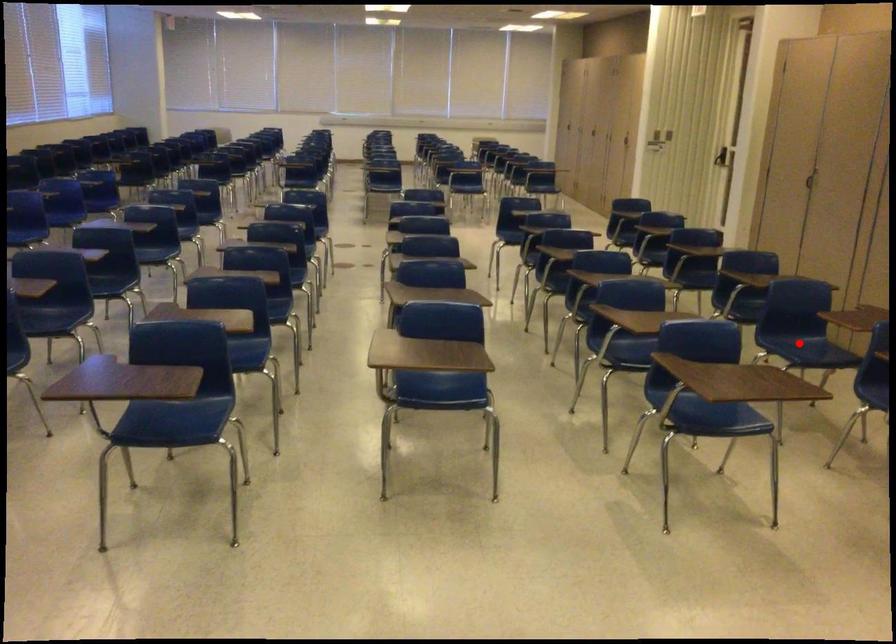
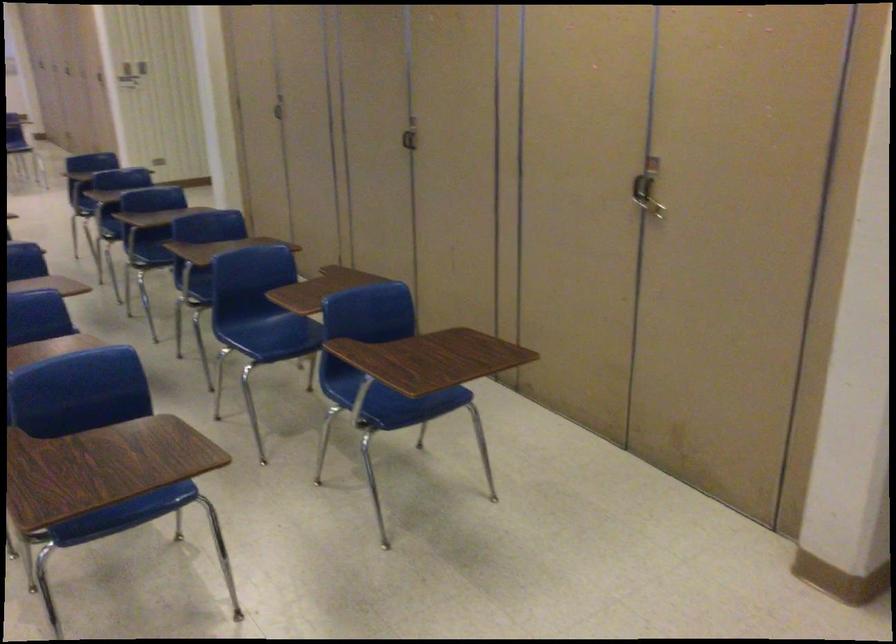
Find the pixel in the second image that matches the highlighted location in the first image.

(272, 328)